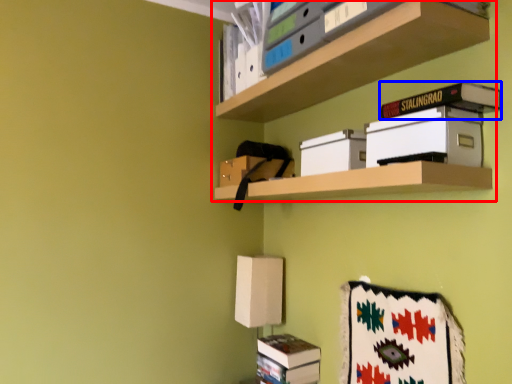
Question: Which object appears farthest to the camera in this image, shelf (highlighted by a red box) or paperback book (highlighted by a blue box)?

Choices:
 (A) shelf
 (B) paperback book

Answer: (B)